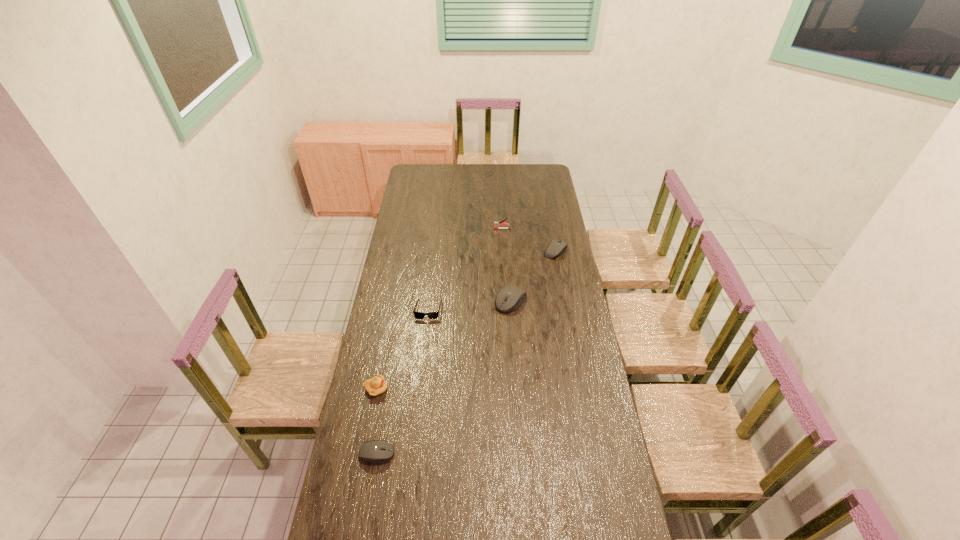
Locate an element on the screen. Image resolution: width=960 pixels, height=540 pixels. vacant space that satisfies the following two spatial constraints: 1. on the back side of the second nearest computer equipment; 2. on the handle side of the farthest object is located at coordinates (506, 229).